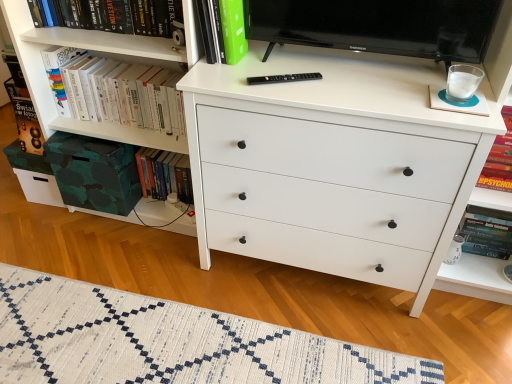
I want to click on vacant area in front of green matte book at upper center, the third book positioned from the left, so click(x=227, y=79).